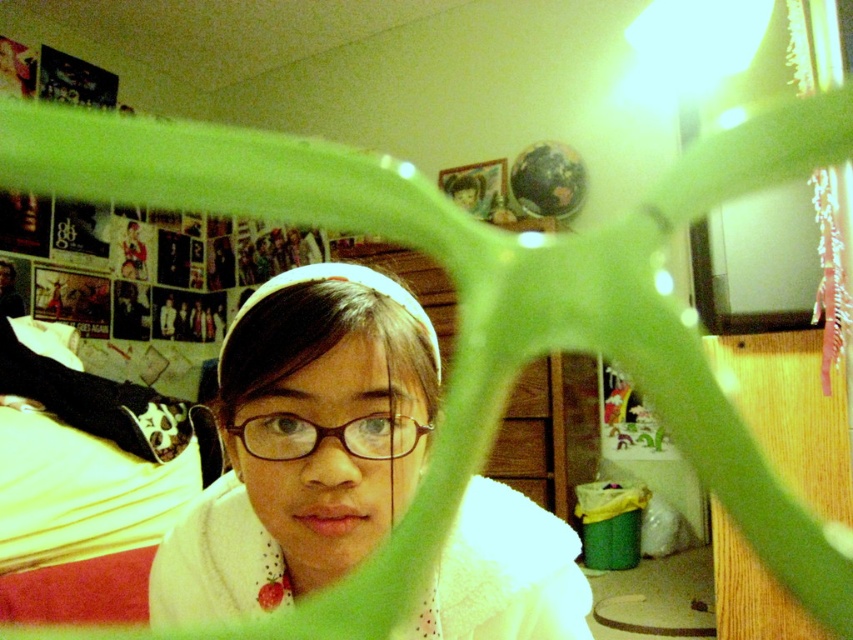
You are a tailor trying to determine which item to alter first. You have the white fluffy robe at center and the brown matte glasses at center. Based on their sizes, which one requires more fabric?

The white fluffy robe at center is larger in size than the brown matte glasses at center, so it requires more fabric.

You are a photographer trying to capture a clear shot of the brown matte glasses at center. However, the white fluffy robe at center is blocking your view. Can you move the robe to get a better angle?

The white fluffy robe at center is closer to the viewer than the brown matte glasses at center, so moving the robe would allow you to see the brown matte glasses at center clearly.